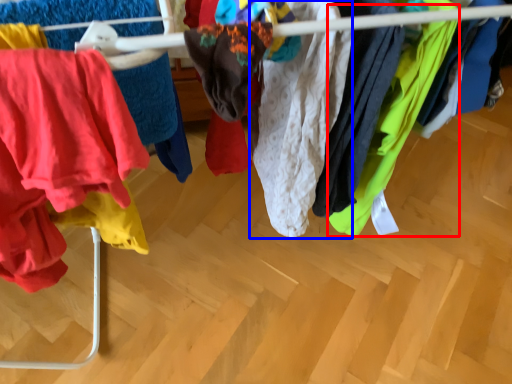
Question: Among these objects, which one is farthest to the camera, clothing (highlighted by a red box) or clothing (highlighted by a blue box)?

Choices:
 (A) clothing
 (B) clothing

Answer: (A)